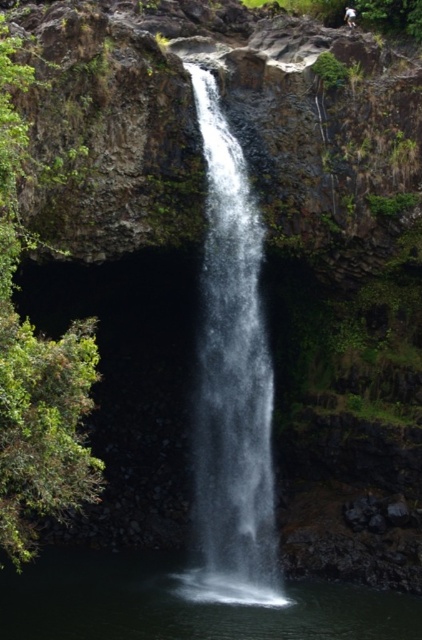
You are standing at the origin point of the coordinate system. You want to reach the clear water at center. What are the coordinates you need to move to?

The clear water at center is located at coordinates point (232, 384). So you need to move to coordinates (232, 384).

You are standing at the edge of the waterfall and notice a white cotton shirt at center and white frothy water at center. Which object is wider?

The white frothy water at center is wider than the white cotton shirt at center.